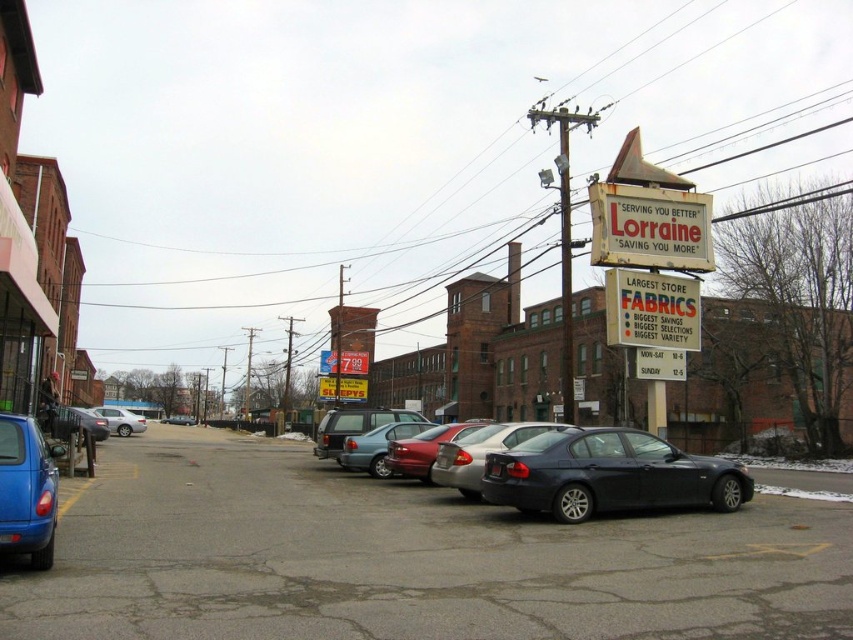
You are a delivery person who needs to park your van in the matte asphalt parking lot at center. However, there is a metallic silver sedan at center blocking the entrance. Based on the scene, can you drive around the sedan to access the parking lot?

The matte asphalt parking lot at center is to the right of the metallic silver sedan at center, so you can drive around the sedan to the right side to access the parking lot.

You are a delivery person needing to park your van between the shiny red sedan at center and the shiny black sedan at left. Given that your van is 5 meters long, can you fit it in the space between them?

The shiny red sedan at center is larger in size than the shiny black sedan at left, but the exact distance between them isn not provided. Without knowing the actual space between the two sedans, it is impossible to determine if the van will fit.